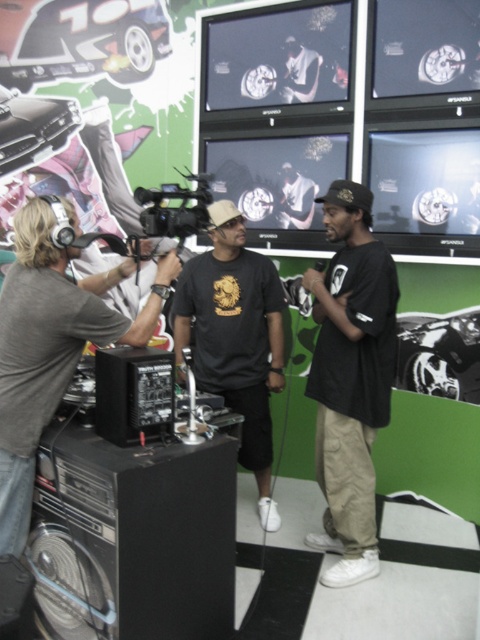
Question: Which point is closer to the camera?

Choices:
 (A) gray fabric headphones at left
 (B) black matte t-shirt at center
 (C) black cotton shirt at center
 (D) black plastic video camera at center

Answer: (A)

Question: Which point is closer to the camera?

Choices:
 (A) black matte t-shirt at center
 (B) black plastic video camera at center
 (C) black cotton shirt at center

Answer: (C)

Question: Does gray fabric headphones at left come in front of black matte t-shirt at center?

Choices:
 (A) yes
 (B) no

Answer: (A)

Question: Is gray fabric headphones at left wider than black plastic video camera at center?

Choices:
 (A) no
 (B) yes

Answer: (B)

Question: Which of the following is the farthest from the observer?

Choices:
 (A) (235, 289)
 (B) (212, 198)
 (C) (347, 188)

Answer: (A)

Question: Is black cotton shirt at center bigger than black plastic video camera at center?

Choices:
 (A) yes
 (B) no

Answer: (A)